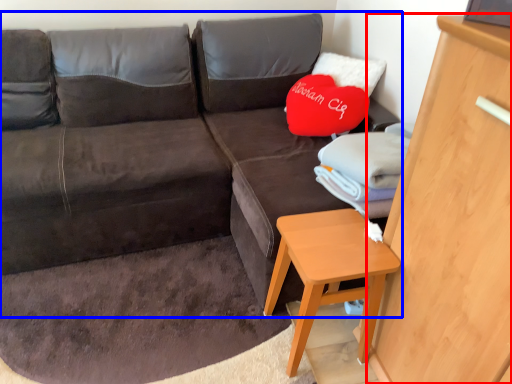
Question: Which point is closer to the camera, dresser (highlighted by a red box) or studio couch (highlighted by a blue box)?

Choices:
 (A) dresser
 (B) studio couch

Answer: (A)